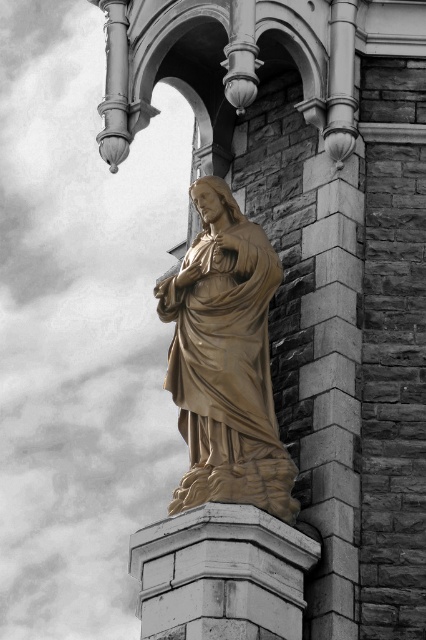
Is point (195, 372) less distant than point (316, 550)?

No, it is behind (316, 550).

Is gold polished stone statue at center wider than white stone pedestal at center?

Incorrect, gold polished stone statue at center's width does not surpass white stone pedestal at center's.

Measure the distance between point (261, 451) and camera.

Point (261, 451) and camera are 169.77 feet apart from each other.

Where is `gold polished stone statue at center`? This screenshot has width=426, height=640. gold polished stone statue at center is located at coordinates (226, 362).